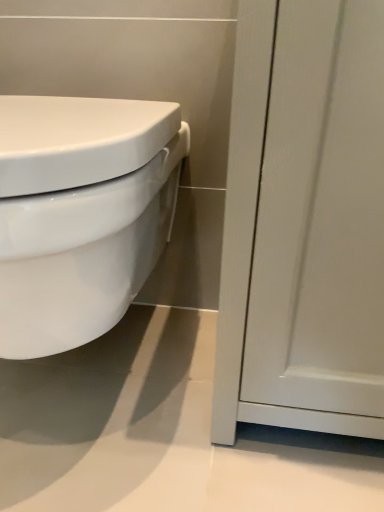
Question: Is white glossy toilet at left with matte white cabinet at right?

Choices:
 (A) yes
 (B) no

Answer: (B)

Question: Does white glossy toilet at left contain matte white cabinet at right?

Choices:
 (A) yes
 (B) no

Answer: (B)

Question: Considering the relative sizes of white glossy toilet at left and matte white cabinet at right in the image provided, is white glossy toilet at left thinner than matte white cabinet at right?

Choices:
 (A) yes
 (B) no

Answer: (B)

Question: From the image's perspective, is white glossy toilet at left over matte white cabinet at right?

Choices:
 (A) no
 (B) yes

Answer: (A)

Question: Is white glossy toilet at left further to camera compared to matte white cabinet at right?

Choices:
 (A) no
 (B) yes

Answer: (A)

Question: From the image's perspective, is white glossy toilet at left below matte white cabinet at right?

Choices:
 (A) yes
 (B) no

Answer: (A)

Question: Considering the relative positions of matte white cabinet at right and white glossy toilet at left in the image provided, is matte white cabinet at right to the left of white glossy toilet at left from the viewer's perspective?

Choices:
 (A) no
 (B) yes

Answer: (A)

Question: Can you confirm if matte white cabinet at right is positioned to the right of white glossy toilet at left?

Choices:
 (A) no
 (B) yes

Answer: (B)

Question: Can you confirm if matte white cabinet at right is bigger than white glossy toilet at left?

Choices:
 (A) no
 (B) yes

Answer: (A)

Question: Can you see matte white cabinet at right touching white glossy toilet at left?

Choices:
 (A) yes
 (B) no

Answer: (B)

Question: From a real-world perspective, is matte white cabinet at right located higher than white glossy toilet at left?

Choices:
 (A) no
 (B) yes

Answer: (B)

Question: Is matte white cabinet at right turned away from white glossy toilet at left?

Choices:
 (A) yes
 (B) no

Answer: (B)

Question: In terms of width, does matte white cabinet at right look wider or thinner when compared to white glossy toilet at left?

Choices:
 (A) thin
 (B) wide

Answer: (A)